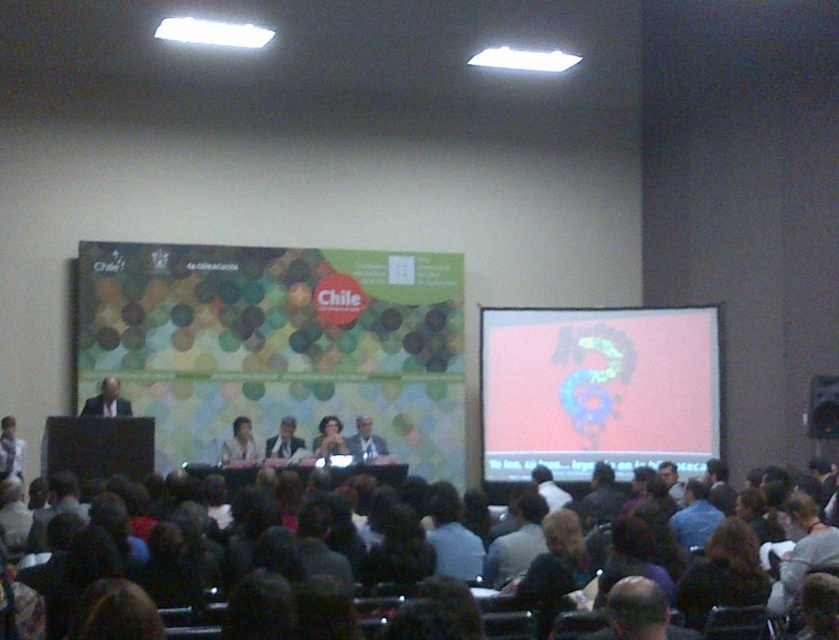
Question: Which point is farther to the camera?

Choices:
 (A) light brown hair at center
 (B) matte black dress at center
 (C) dark hair at lower center

Answer: (B)

Question: Does pink matte projection screen at upper right appear over matte black suit at left?

Choices:
 (A) no
 (B) yes

Answer: (B)

Question: Does dark hair at lower center have a lesser width compared to matte black dress at center?

Choices:
 (A) yes
 (B) no

Answer: (B)

Question: Which point is farther from the camera taking this photo?

Choices:
 (A) (546, 394)
 (B) (274, 612)
 (C) (238, 424)

Answer: (A)

Question: Estimate the real-world distances between objects in this image. Which object is farther from the matte black dress at center?

Choices:
 (A) light brown leather jacket at center
 (B) pink matte projection screen at upper right

Answer: (B)

Question: Can you confirm if matte black suit at left is positioned to the left of light brown leather jacket at center?

Choices:
 (A) no
 (B) yes

Answer: (B)